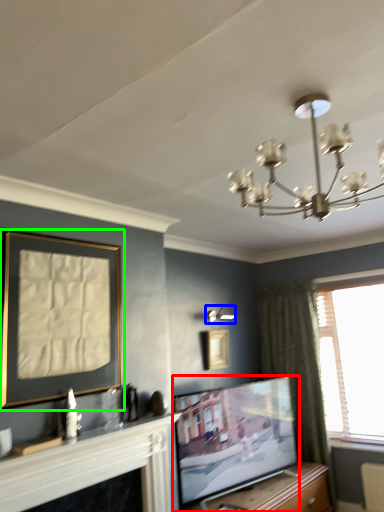
Question: Which object is positioned farthest from television (highlighted by a red box)? Select from lamp (highlighted by a blue box) and picture frame (highlighted by a green box).

Choices:
 (A) lamp
 (B) picture frame

Answer: (B)